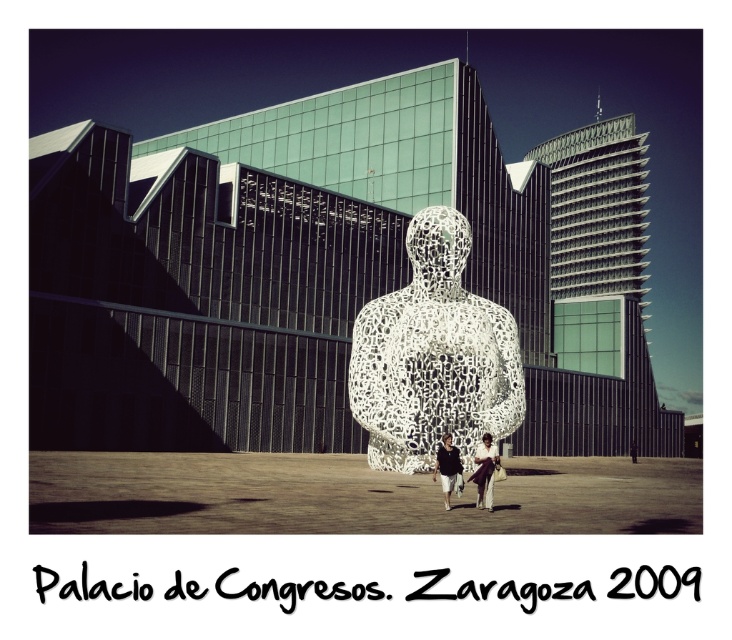
Who is higher up, white porous sculpture at center or white textured sculpture at center?

white porous sculpture at center is above.

Describe the element at coordinates (433, 355) in the screenshot. The width and height of the screenshot is (732, 640). I see `white porous sculpture at center` at that location.

Is point (447, 392) positioned after point (474, 461)?

That is True.

At what (x,y) coordinates should I click in order to perform the action: click on white porous sculpture at center. Please return your answer as a coordinate pair (x, y). Image resolution: width=732 pixels, height=640 pixels. Looking at the image, I should click on (433, 355).

Consider the image. Who is positioned more to the left, white textured sculpture at center or dark gray fabric pants at lower center?

dark gray fabric pants at lower center is more to the left.

Which of these two, white textured sculpture at center or dark gray fabric pants at lower center, stands taller?

Standing taller between the two is white textured sculpture at center.

Which is behind, point (492, 483) or point (444, 474)?

Point (444, 474)

The width and height of the screenshot is (732, 640). I want to click on white textured sculpture at center, so click(485, 472).

Who is taller, white porous sculpture at center or dark gray fabric pants at lower center?

white porous sculpture at center is taller.

In the scene shown: Who is higher up, white porous sculpture at center or dark gray fabric pants at lower center?

white porous sculpture at center is higher up.

You are a GUI agent. You are given a task and a screenshot of the screen. Output one action in this format:
    pyautogui.click(x=<x>, y=<y>)
    Task: Click on the white porous sculpture at center
    The height and width of the screenshot is (640, 732).
    Given the screenshot: What is the action you would take?
    pyautogui.click(x=433, y=355)